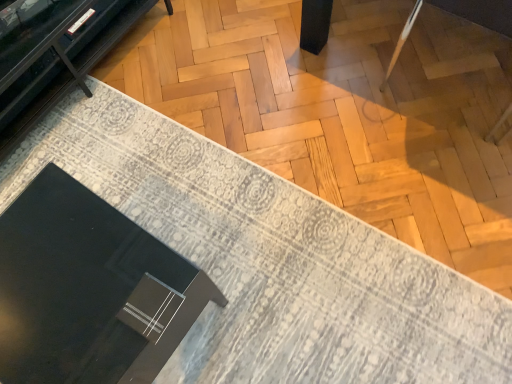
Question: Is matte black box at lower left placed right next to black glossy round table at lower left?

Choices:
 (A) no
 (B) yes

Answer: (A)

Question: Is matte black box at lower left completely or partially outside of black glossy round table at lower left?

Choices:
 (A) yes
 (B) no

Answer: (A)

Question: Does matte black box at lower left have a lesser height compared to black glossy round table at lower left?

Choices:
 (A) no
 (B) yes

Answer: (B)

Question: Would you say black glossy round table at lower left is part of matte black box at lower left's contents?

Choices:
 (A) yes
 (B) no

Answer: (B)

Question: Is matte black box at lower left not close to black glossy round table at lower left?

Choices:
 (A) yes
 (B) no

Answer: (B)

Question: From the image's perspective, would you say matte black box at lower left is positioned over black glossy round table at lower left?

Choices:
 (A) no
 (B) yes

Answer: (B)

Question: Is matte black box at lower left completely or partially inside black glossy round table at lower left?

Choices:
 (A) yes
 (B) no

Answer: (B)

Question: Considering the relative sizes of black glossy round table at lower left and matte black box at lower left in the image provided, is black glossy round table at lower left shorter than matte black box at lower left?

Choices:
 (A) yes
 (B) no

Answer: (B)

Question: Can you confirm if black glossy round table at lower left is positioned to the left of matte black box at lower left?

Choices:
 (A) no
 (B) yes

Answer: (B)

Question: Is black glossy round table at lower left positioned in front of matte black box at lower left?

Choices:
 (A) yes
 (B) no

Answer: (A)

Question: Are black glossy round table at lower left and matte black box at lower left located far from each other?

Choices:
 (A) no
 (B) yes

Answer: (A)

Question: Can you confirm if black glossy round table at lower left is wider than matte black box at lower left?

Choices:
 (A) yes
 (B) no

Answer: (B)

Question: From the image's perspective, would you say matte black box at lower left is shown under matte black tv stand at upper left?

Choices:
 (A) yes
 (B) no

Answer: (A)